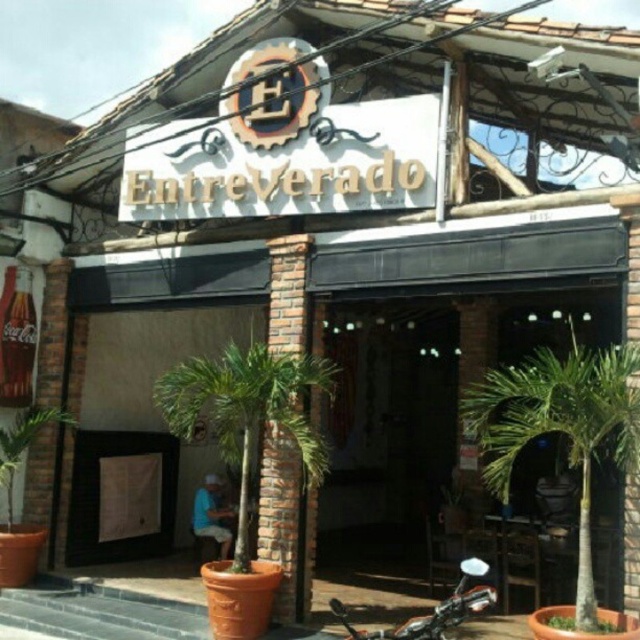
Question: Which point appears farthest from the camera in this image?

Choices:
 (A) (573, 358)
 (B) (237, 369)
 (C) (460, 608)

Answer: (B)

Question: Which of these objects is positioned closest to the green leafy palm tree at center?

Choices:
 (A) green leafy palm tree at right
 (B) shiny chrome motorcycle at lower center

Answer: (B)

Question: Does green leafy palm tree at right appear on the right side of green leafy palm tree at center?

Choices:
 (A) no
 (B) yes

Answer: (B)

Question: Does green leafy palm tree at right have a lesser width compared to shiny chrome motorcycle at lower center?

Choices:
 (A) no
 (B) yes

Answer: (B)

Question: Does green leafy palm tree at right have a lesser width compared to green leafy palm tree at center?

Choices:
 (A) no
 (B) yes

Answer: (B)

Question: Based on their relative distances, which object is farther from the shiny chrome motorcycle at lower center?

Choices:
 (A) green leafy palm tree at center
 (B) green leafy palm tree at right

Answer: (A)